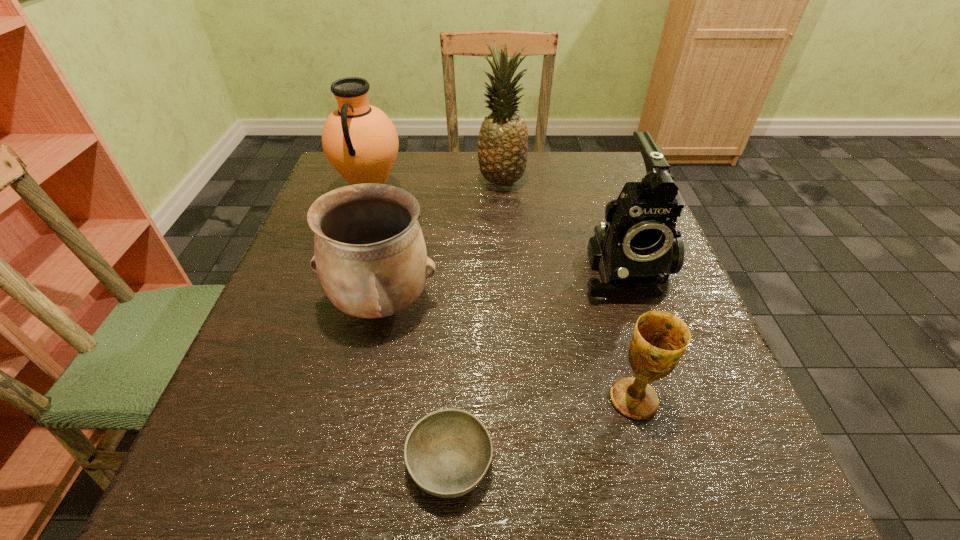
Identify the location of free space between the tallest object and the camcorder. The width and height of the screenshot is (960, 540). (562, 225).

What are the coordinates of `empty space between the shortest object and the pineapple` in the screenshot? It's located at (475, 323).

Where is `vacant space that is in between the bowl and the fifth tallest object`? vacant space that is in between the bowl and the fifth tallest object is located at coordinates (541, 431).

Where is `vacant area between the camcorder and the pitcher`? This screenshot has width=960, height=540. vacant area between the camcorder and the pitcher is located at coordinates (497, 232).

This screenshot has width=960, height=540. I want to click on free space between the nearest object and the pineapple, so click(x=475, y=323).

Locate an element on the screen. unoccupied area between the pitcher and the fifth tallest object is located at coordinates (502, 298).

Locate an element on the screen. free area in between the camcorder and the third shortest object is located at coordinates (502, 285).

Locate an element on the screen. The width and height of the screenshot is (960, 540). free space between the camcorder and the tallest object is located at coordinates (562, 225).

Identify the location of object that is the fifth closest to the bowl. Image resolution: width=960 pixels, height=540 pixels. (502, 150).

Select which object is the fourth closest to the urn. Please provide its 2D coordinates. Your answer should be formatted as a tuple, i.e. [(x, y)], where the tuple contains the x and y coordinates of a point satisfying the conditions above.

[(637, 248)]